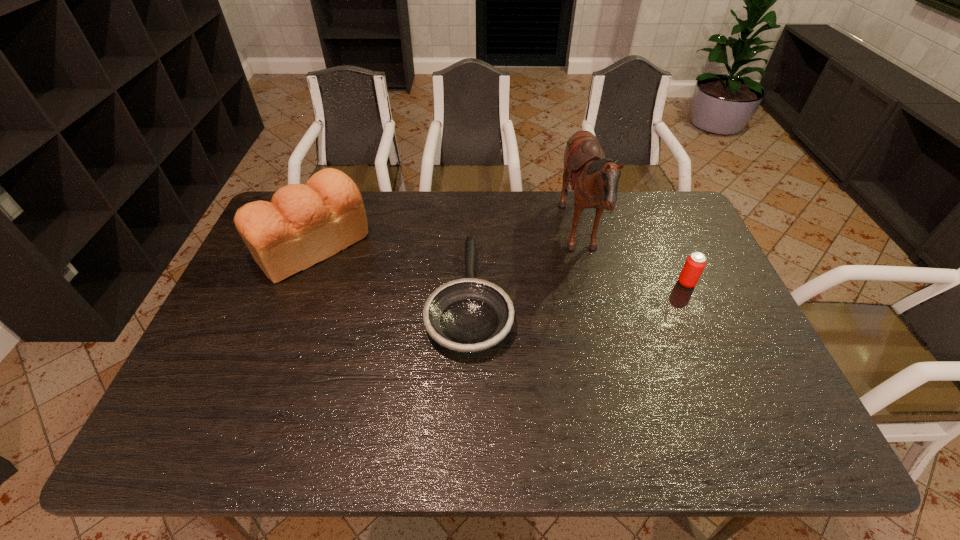
Where is `the tallest object`? the tallest object is located at coordinates pyautogui.click(x=594, y=178).

You are a GUI agent. You are given a task and a screenshot of the screen. Output one action in this format:
    pyautogui.click(x=<x>, y=<y>)
    Task: Click on the saddle
    Image resolution: width=960 pixels, height=540 pixels.
    Given the screenshot: What is the action you would take?
    pyautogui.click(x=594, y=178)

Locate an element on the screen. the third shortest object is located at coordinates (304, 224).

Identify the location of bread. This screenshot has width=960, height=540. (304, 224).

Find the location of a particular element. Image resolution: width=960 pixels, height=540 pixels. beer can is located at coordinates (695, 263).

What are the coordinates of `the rightmost object` in the screenshot? It's located at (695, 263).

Identify the location of the shortest object. (469, 315).

The image size is (960, 540). I want to click on frying pan, so click(x=469, y=315).

Where is `vacant space located 0.190m on the back of the tallest object`? This screenshot has width=960, height=540. vacant space located 0.190m on the back of the tallest object is located at coordinates (502, 237).

What are the coordinates of `free location located 0.210m on the back of the tallest object` in the screenshot? It's located at (496, 237).